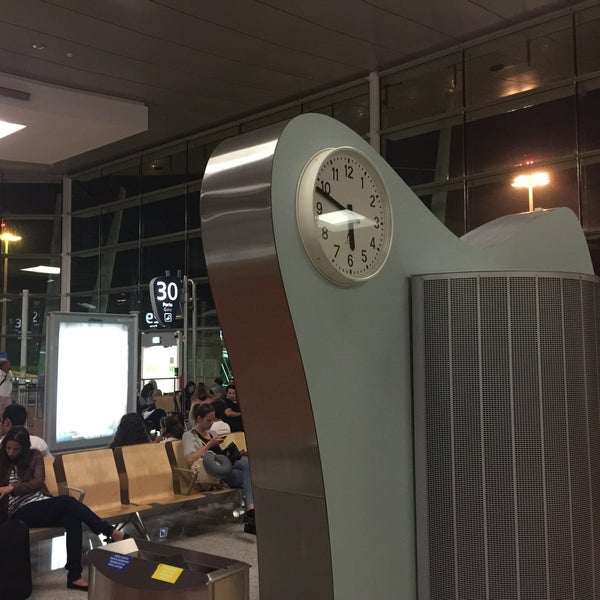
This screenshot has height=600, width=600. I want to click on brown seats, so click(101, 475), click(131, 465), click(173, 445), click(246, 442), click(56, 473).